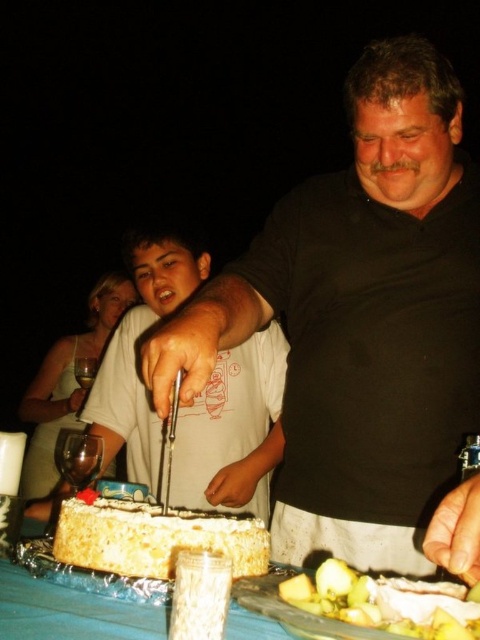
You are at a nighttime outdoor gathering where a man and a boy are cutting into a cake placed on a table. The man is wearing a dark shirt and leaning over the table with a knife. The boy is standing beside him. The cake is round, white, and has a red decoration on top. The table also has aluminum foil underneath the cake. You want to know where the matte black shirt at center is located. Based on the coordinates provided, can you determine if the point at (233, 429) falls within the area of the matte back

The point at (233, 429) corresponds to the matte black shirt at center, so yes, it falls within the area of the matte black shirt at center.

You are at a party and want to pour wine into the transparent glass wine glass at lower left. The matte black shirt at center is in the way. Can you move the glass without moving the shirt?

The matte black shirt at center is much taller than the transparent glass wine glass at lower left. Since the shirt is taller, it might block access to the glass. You would need to move the shirt first or reach around it to access the glass.

You are a guest at the gathering and want to place a dessert plate between the white frosted cake at center and the green leafy salad at lower center. Based on their sizes, can you estimate if there is enough space for the plate?

The white frosted cake at center might be wider than green leafy salad at lower center, so there may not be enough space for the dessert plate between them. Please check the actual distance before placing it.